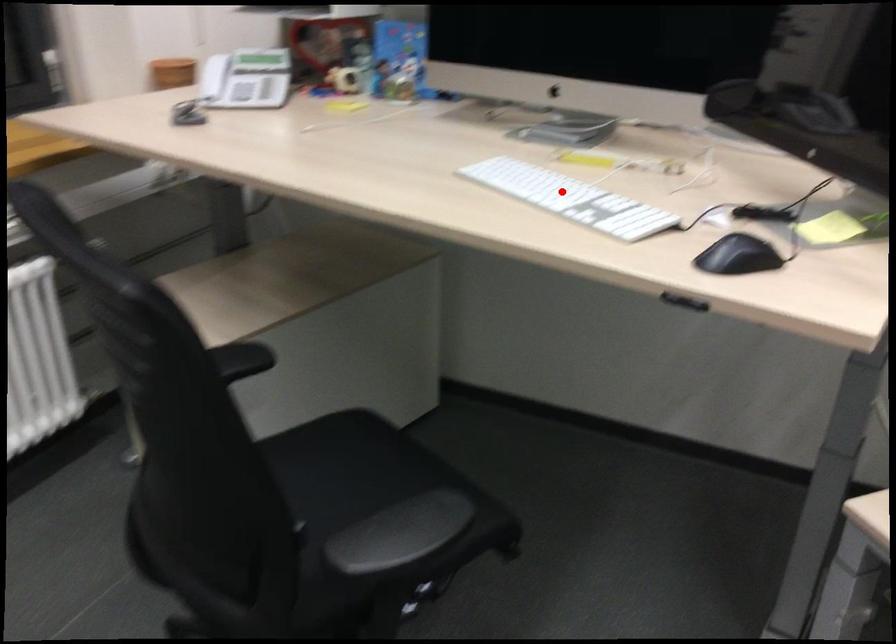
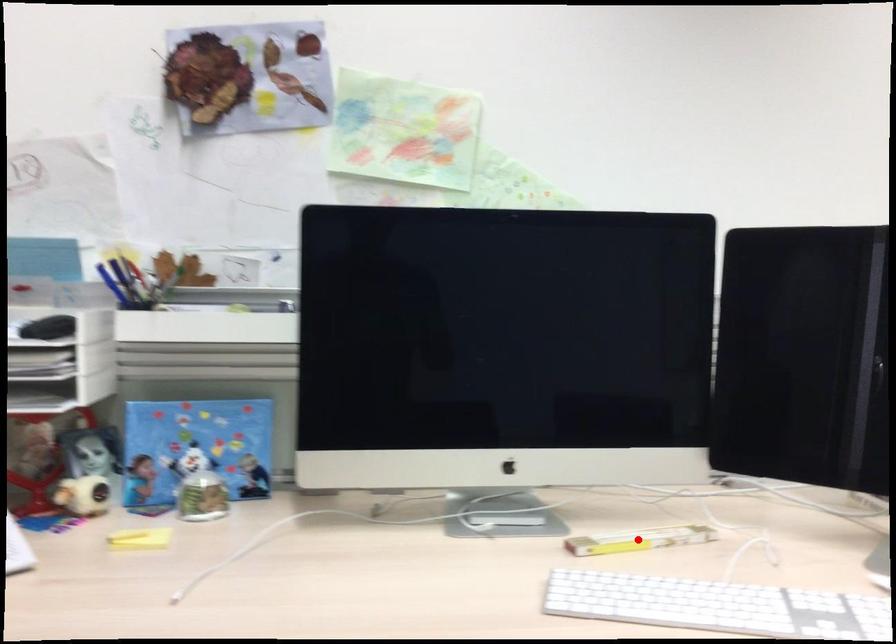
I am providing you with two images of the same scene from different viewpoints. A red point is marked on the first image and another point is marked on the second image. Are the points marked in image1 and image2 representing the same 3D position?

No